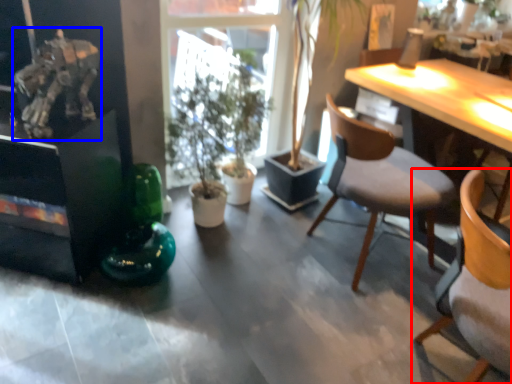
Question: Which of the following is the farthest to the observer, chair (highlighted by a red box) or art (highlighted by a blue box)?

Choices:
 (A) chair
 (B) art

Answer: (B)